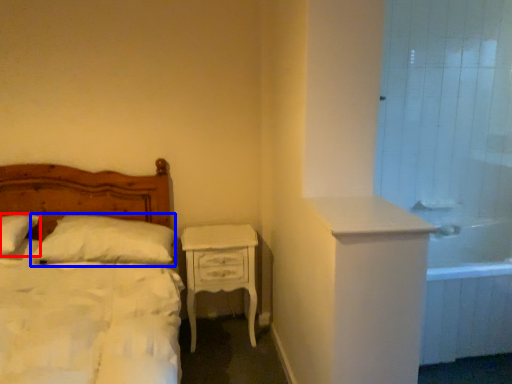
Question: Which of the following is the farthest to the observer, pillow (highlighted by a red box) or pillow (highlighted by a blue box)?

Choices:
 (A) pillow
 (B) pillow

Answer: (B)